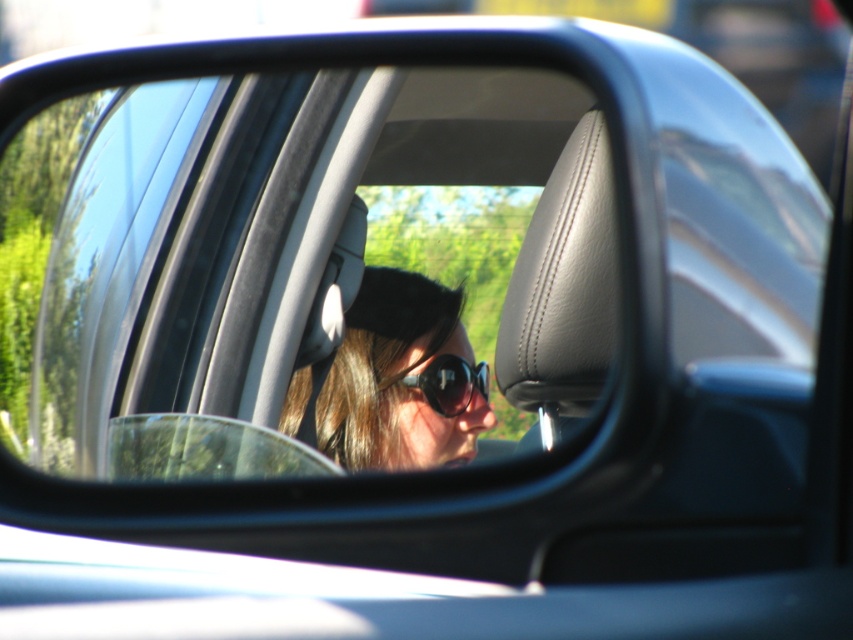
How distant is transparent glass car window at center from sunglasses at center?

3.51 inches

Between transparent glass car window at center and sunglasses at center, which one is positioned lower?

sunglasses at center

Locate an element on the screen. Image resolution: width=853 pixels, height=640 pixels. transparent glass car window at center is located at coordinates (306, 266).

Is sunglasses at center to the left of black plastic sunglasses at center from the viewer's perspective?

Yes, sunglasses at center is to the left of black plastic sunglasses at center.

How distant is sunglasses at center from black plastic sunglasses at center?

4.59 centimeters

Does point (432, 326) come in front of point (416, 360)?

No, it is not.

Find the location of a particular element. This screenshot has height=640, width=853. sunglasses at center is located at coordinates pos(393,380).

Can you confirm if transparent glass car window at center is taller than black plastic sunglasses at center?

Correct, transparent glass car window at center is much taller as black plastic sunglasses at center.

Does point (379, 392) come farther from viewer compared to point (415, 385)?

No.

Where is `transparent glass car window at center`? The image size is (853, 640). transparent glass car window at center is located at coordinates (306, 266).